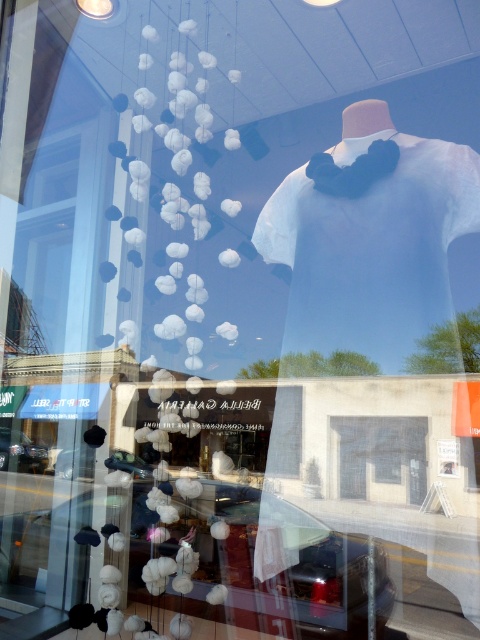
You are a customer looking at the two cars in the storefront window display. The shiny black car at lower center and the metallic silver car at lower center. Which car is placed higher up in the display?

The metallic silver car at lower center is placed higher up in the display since the shiny black car at lower center is positioned under it.

You are standing in front of a car dealership and see two cars in the showroom window. The shiny black car at lower center and the metallic silver car at lower center. Which car is positioned to the right side?

The shiny black car at lower center is positioned to the right of the metallic silver car at lower center.